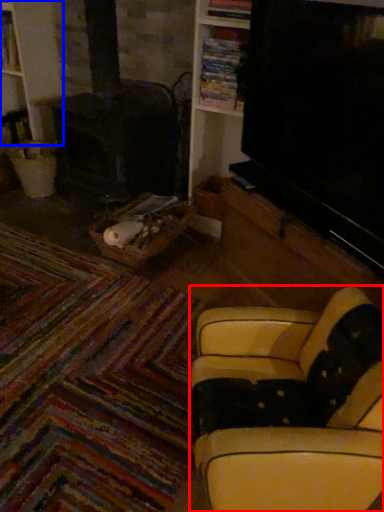
Question: Which of the following is the farthest to the observer, studio couch (highlighted by a red box) or bookshelf (highlighted by a blue box)?

Choices:
 (A) studio couch
 (B) bookshelf

Answer: (B)